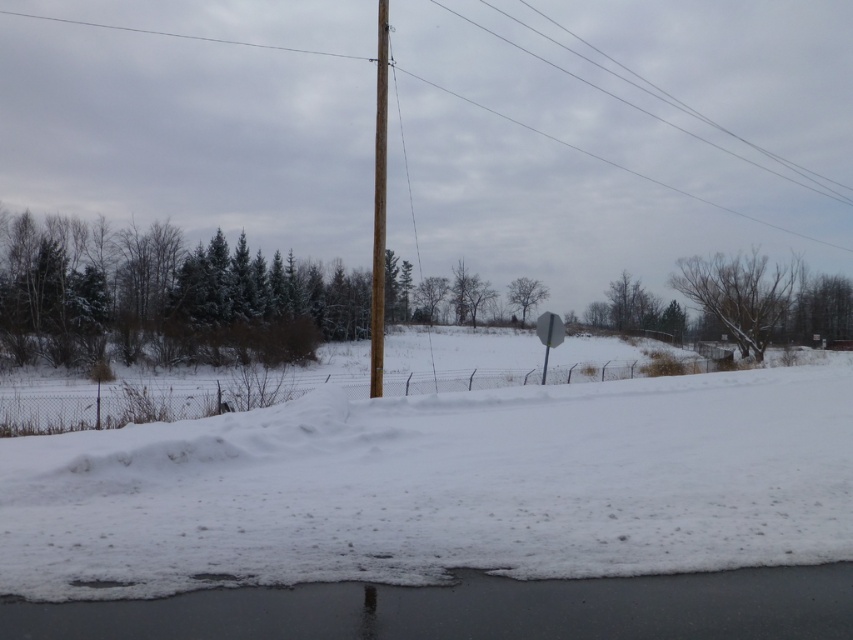
Does brown wooden pole at center have a lesser width compared to brown wooden telegraph pole at center?

→ No.

Who is shorter, brown wooden pole at center or brown wooden telegraph pole at center?

brown wooden pole at center

Which is in front, point (48, 22) or point (379, 42)?

Point (379, 42) is in front.

Locate an element on the screen. brown wooden pole at center is located at coordinates (194, 115).

Can you confirm if white fluffy snow at lower center is positioned to the left of gray matte sign at center?

Yes, white fluffy snow at lower center is to the left of gray matte sign at center.

Is white fluffy snow at lower center behind gray matte sign at center?

No, it is not.

Is point (128, 525) positioned behind point (549, 321)?

No, it is not.

Where is `white fluffy snow at lower center`? This screenshot has width=853, height=640. white fluffy snow at lower center is located at coordinates (440, 486).

Is white foam at lower center below brown wooden telegraph pole at center?

Yes.

Does white foam at lower center have a smaller size compared to brown wooden telegraph pole at center?

Indeed, white foam at lower center has a smaller size compared to brown wooden telegraph pole at center.

What do you see at coordinates (471, 609) in the screenshot? I see `white foam at lower center` at bounding box center [471, 609].

At what (x,y) coordinates should I click in order to perform the action: click on white foam at lower center. Please return your answer as a coordinate pair (x, y). The image size is (853, 640). Looking at the image, I should click on (471, 609).